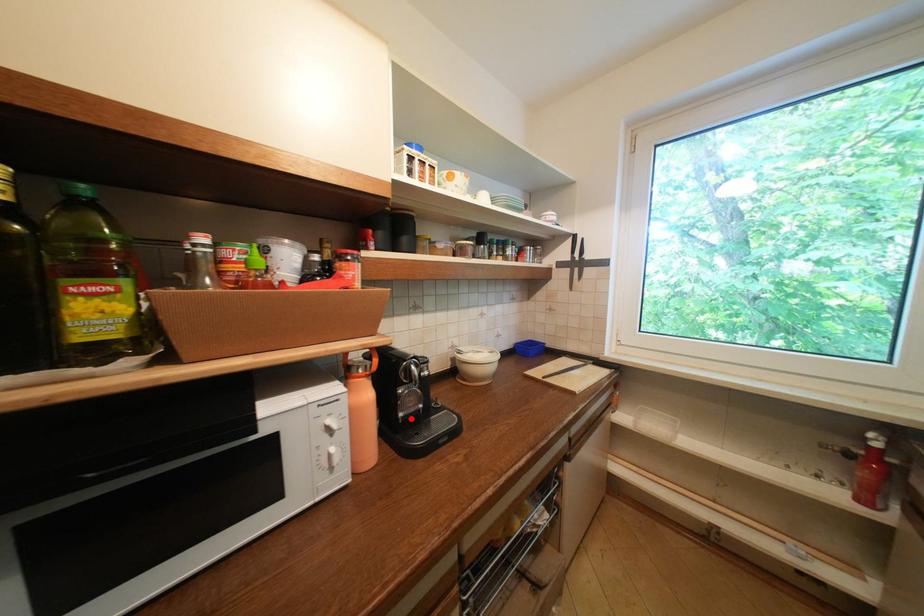
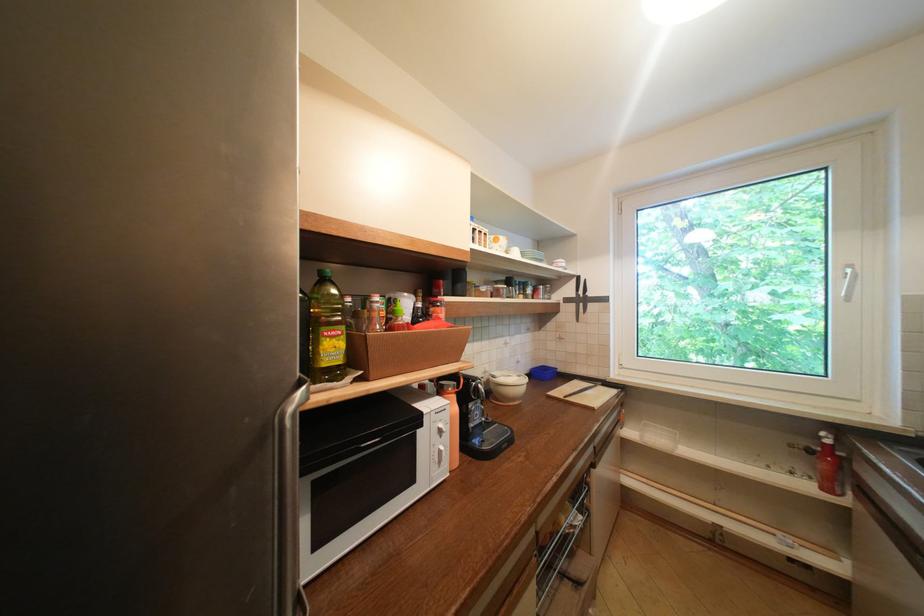
Question: I am providing you with two images of the same scene from different viewpoints. A red point is marked on the first image. Can you still see the location of the red point in image 2?

Choices:
 (A) Yes
 (B) No

Answer: (A)